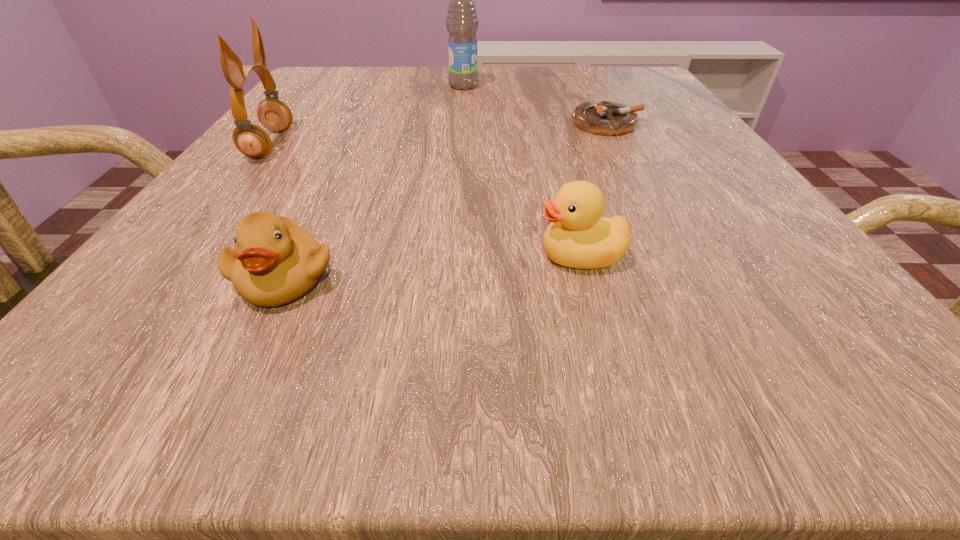
Identify the location of free spot between the shortest object and the third object from left to right. The height and width of the screenshot is (540, 960). (535, 104).

You are a GUI agent. You are given a task and a screenshot of the screen. Output one action in this format:
    pyautogui.click(x=<x>, y=<y>)
    Task: Click on the empty space that is in between the ashtray and the third object from right to left
    This screenshot has height=540, width=960.
    Given the screenshot: What is the action you would take?
    [x=535, y=104]

Identify the location of free space between the duckling and the leftmost object. The width and height of the screenshot is (960, 540). (276, 211).

I want to click on the closest object to the ashtray, so click(x=462, y=23).

Choose which object is the second nearest neighbor to the duck. Please provide its 2D coordinates. Your answer should be formatted as a tuple, i.e. [(x, y)], where the tuple contains the x and y coordinates of a point satisfying the conditions above.

[(606, 118)]

This screenshot has width=960, height=540. I want to click on vacant area in the image that satisfies the following two spatial constraints: 1. on the front side of the water bottle; 2. on the right side of the ashtray, so click(x=461, y=123).